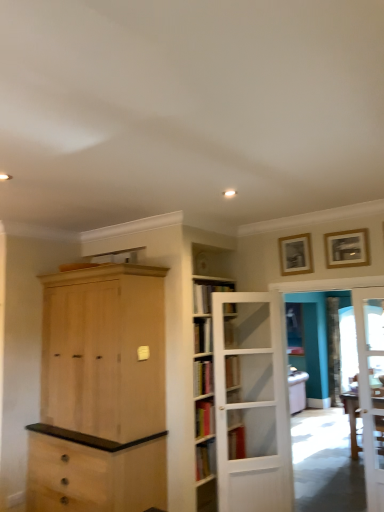
Question: Considering the positions of wooden picture frame at upper right, which is counted as the 1th picture frame, starting from the right, and gold wooden picture frame at upper right, the second picture frame viewed from the right, in the image, is wooden picture frame at upper right, which is counted as the 1th picture frame, starting from the right, bigger or smaller than gold wooden picture frame at upper right, the second picture frame viewed from the right,?

Choices:
 (A) small
 (B) big

Answer: (A)

Question: Considering the positions of wooden picture frame at upper right, which is the 2th picture frame from back to front, and gold wooden picture frame at upper right, which is counted as the 1th picture frame, starting from the back, in the image, is wooden picture frame at upper right, which is the 2th picture frame from back to front, wider or thinner than gold wooden picture frame at upper right, which is counted as the 1th picture frame, starting from the back,?

Choices:
 (A) thin
 (B) wide

Answer: (A)

Question: Estimate the real-world distances between objects in this image. Which object is closer to the natural wood cabinet at center?

Choices:
 (A) white glass door at right, which is the 2th door from left to right
 (B) wooden table at right
 (C) white wooden door at center, the first door when ordered from left to right
 (D) clear glass door at center
 (E) wooden picture frame at upper right, which is the 1th picture frame in front-to-back order

Answer: (C)

Question: Which of these objects is positioned farthest from the hardcover book at center?

Choices:
 (A) white wooden door at center, the first door when ordered from left to right
 (B) clear glass door at center
 (C) gold wooden picture frame at upper right, the second picture frame viewed from the right
 (D) wooden table at right
 (E) natural wood cabinet at center

Answer: (B)